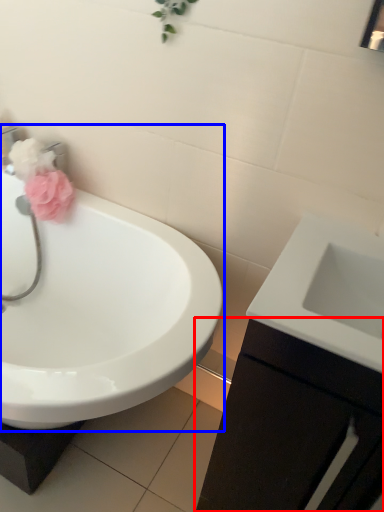
Question: Which object is further to the camera taking this photo, bathroom cabinet (highlighted by a red box) or sink (highlighted by a blue box)?

Choices:
 (A) bathroom cabinet
 (B) sink

Answer: (B)